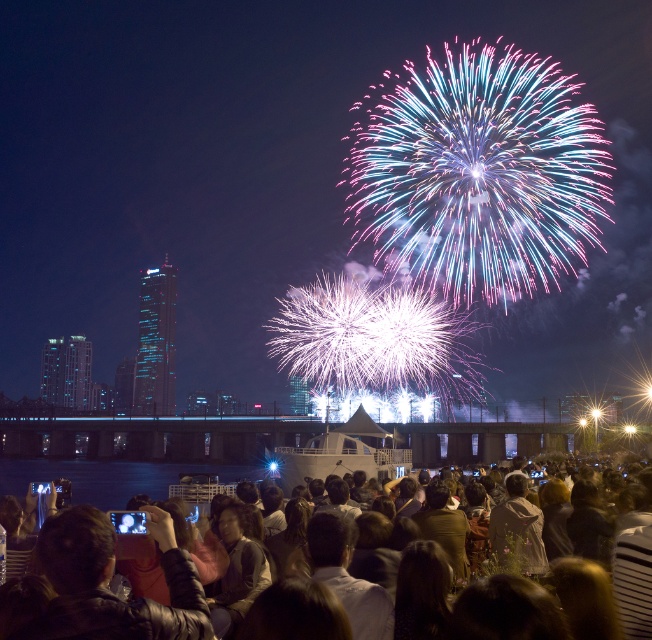
You are a photographer trying to capture the fireworks display. You notice the transparent water at lower center and the dark brown hair at lower center in your frame. Which object should you adjust your focus to ensure the wider subject is in the foreground?

The dark brown hair at lower center is wider than the transparent water at lower center, so you should focus on the dark brown hair at lower center to ensure the wider subject is in the foreground.

You are standing at the edge of the water and want to take a photo of the fireworks display. Which object in the scene is closer to you, the transparent water at lower center or the dark brown hair at lower center?

The transparent water at lower center is closer to you than the dark brown hair at lower center because it occupies less space in the scene, indicating proximity.

You are a photographer standing at the back of the crowd. You want to take a photo of the fireworks display while ensuring the transparent water at lower center and dark brown hair at lower center are both in the frame. Given the distance between them, is it possible to capture both in a single shot without moving your position?

The distance between the transparent water at lower center and dark brown hair at lower center is 8.37 feet. Since they are both located at the lower center area, it is likely possible to capture both in a single shot without moving your position, as their proximity allows them to fit within the camera frame.